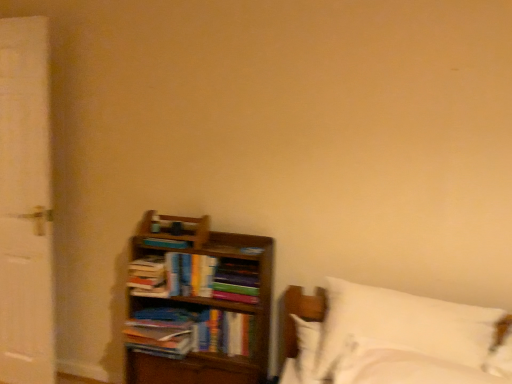
Question: Would you say hardcover books at center, the second book when ordered from bottom to top, is to the left or to the right of wooden bookcase at lower left in the picture?

Choices:
 (A) right
 (B) left

Answer: (A)

Question: Is hardcover books at center, the second book when ordered from bottom to top, wider or thinner than wooden bookcase at lower left?

Choices:
 (A) thin
 (B) wide

Answer: (A)

Question: Which of these objects is positioned farthest from the hardcover book at center, which ranks as the first book in bottom-to-top order?

Choices:
 (A) hardcover books at center, the 3th book in the top-to-bottom sequence
 (B) hardcover book at left, which appears as the 1th book when viewed from the top
 (C) wooden bookcase at lower left
 (D) white soft bed at lower right
 (E) white painted wood screen door at left

Answer: (E)

Question: Which object is the closest to the white soft bed at lower right?

Choices:
 (A) hardcover book at center, the fourth book positioned from the top
 (B) white painted wood screen door at left
 (C) hardcover books at left, which appears as the 2th book when viewed from the top
 (D) wooden bookcase at lower left
 (E) hardcover book at left, positioned as the fourth book in bottom-to-top order

Answer: (A)